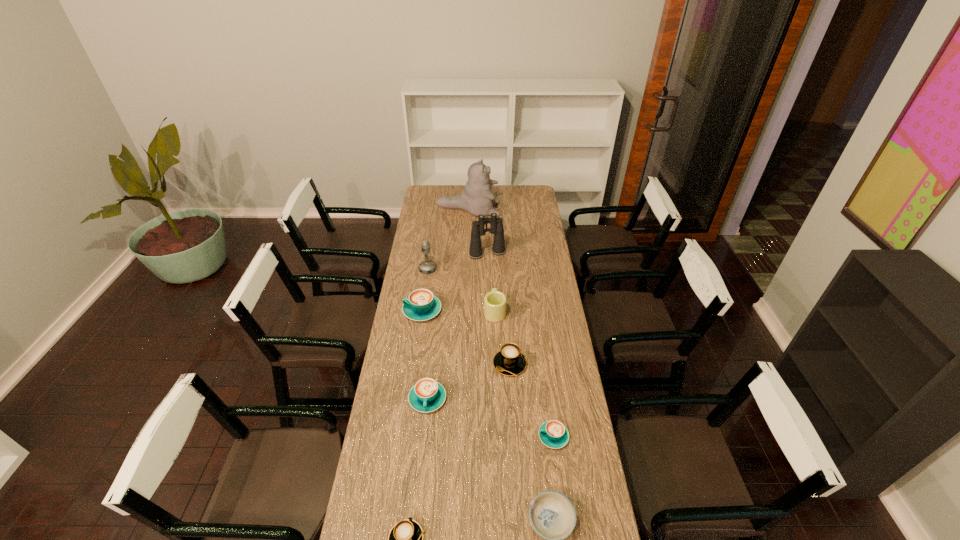
What are the coordinates of `object that is positioned at the right edge` in the screenshot? It's located at (553, 434).

Where is `object that is positioned at the far left corner`? This screenshot has width=960, height=540. object that is positioned at the far left corner is located at coordinates click(477, 199).

The image size is (960, 540). I want to click on vacant space at the far edge, so click(493, 187).

At what (x,y) coordinates should I click in order to perform the action: click on vacant region at the left edge of the desktop. Please return your answer as a coordinate pair (x, y). The height and width of the screenshot is (540, 960). Looking at the image, I should click on (396, 357).

Find the location of `free region at the right edge of the desktop`. free region at the right edge of the desktop is located at coordinates (543, 388).

This screenshot has height=540, width=960. I want to click on vacant space at the far left corner of the desktop, so click(441, 186).

Where is `vacant space at the far right corner`? This screenshot has height=540, width=960. vacant space at the far right corner is located at coordinates (515, 188).

Locate an element on the screen. The width and height of the screenshot is (960, 540). vacant area that lies between the farthest turquoise cappuccino and the ninth shortest object is located at coordinates (455, 282).

Locate an element on the screen. blank region between the fourth tallest object and the microphone is located at coordinates (461, 290).

I want to click on free space between the biggest turquoise cappuccino and the cat, so pyautogui.click(x=445, y=260).